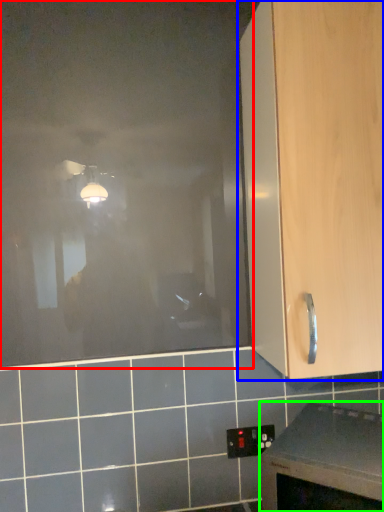
Question: Estimate the real-world distances between objects in this image. Which object is closer to glass door (highlighted by a red box), cabinetry (highlighted by a blue box) or countertop (highlighted by a green box)?

Choices:
 (A) cabinetry
 (B) countertop

Answer: (A)